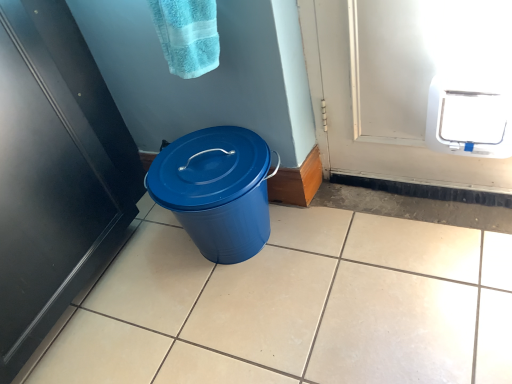
Find the location of a particular element. vacant space to the right of blue plastic trash can at center is located at coordinates (344, 231).